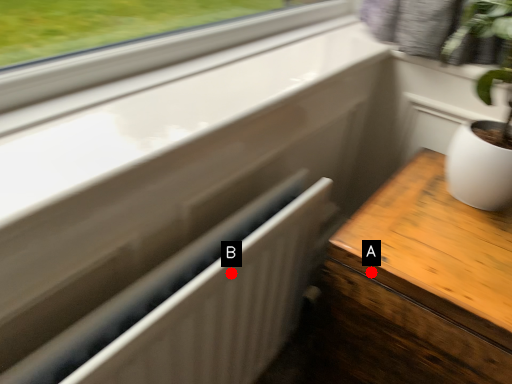
Question: Two points are circled on the image, labeled by A and B beside each circle. Which point is closer to the camera?

Choices:
 (A) A is closer
 (B) B is closer

Answer: (B)